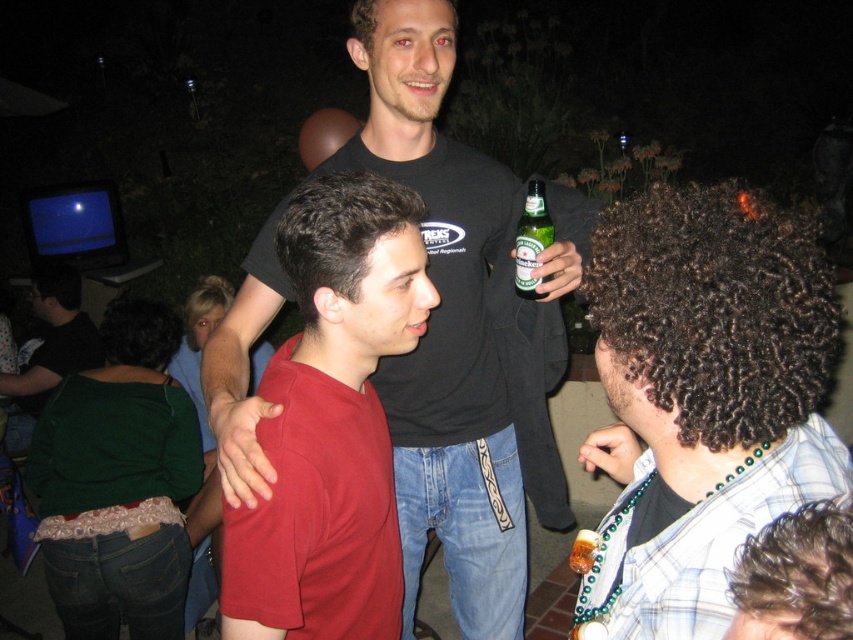
You are at a party and want to hand a gift to the taller person between the matte black shirt at center and the matte red shirt at center. Which one should you approach?

The matte black shirt at center is taller than the matte red shirt at center, so you should approach the matte black shirt at center.

You are at a party and want to hand the green glass bottle at center to someone. The person you want to give it to is standing where the matte black shirt at center is. Can you directly hand the bottle to them without moving the bottle from its current position?

The matte black shirt at center is positioned under the green glass bottle at center, so the bottle is already above the person. You can directly hand the green glass bottle at center to them without moving it from its current position.

Based on the scene description, where exactly is the matte black shirt at center located in terms of coordinates?

The matte black shirt at center is located at point coordinates of (463,330).